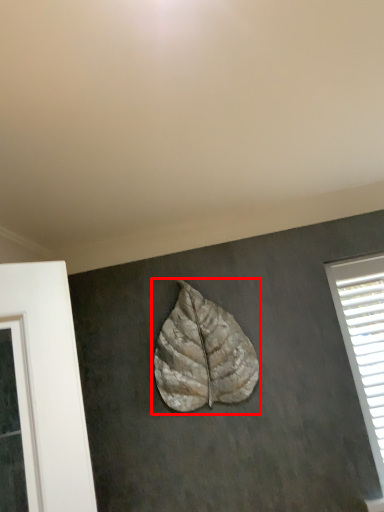
Question: From the image, what is the correct spatial relationship of leaf (annotated by the red box) in relation to window?

Choices:
 (A) right
 (B) left

Answer: (B)